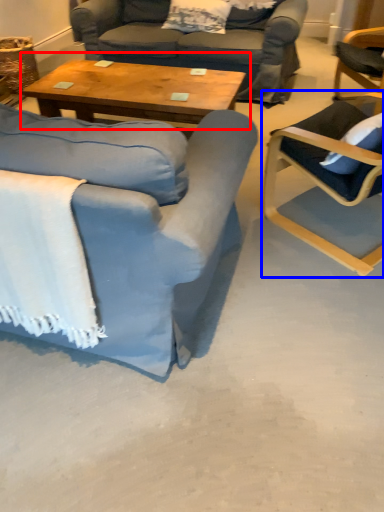
Question: Among these objects, which one is nearest to the camera, coffee table (highlighted by a red box) or chair (highlighted by a blue box)?

Choices:
 (A) coffee table
 (B) chair

Answer: (B)